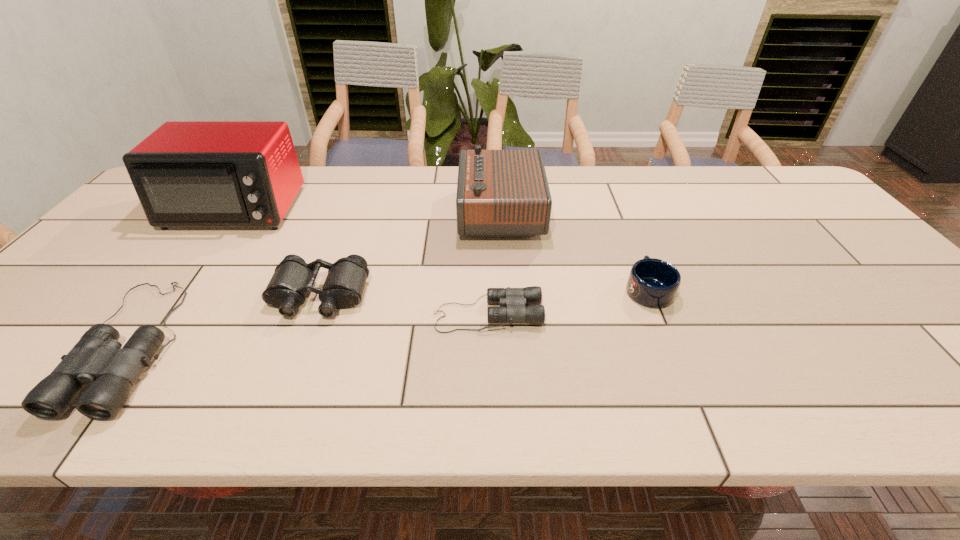
The height and width of the screenshot is (540, 960). In order to click on object that is at the far left corner in this screenshot , I will do `click(186, 173)`.

Image resolution: width=960 pixels, height=540 pixels. What are the coordinates of `vacant space at the far edge of the desktop` in the screenshot? It's located at (694, 171).

Locate an element on the screen. The height and width of the screenshot is (540, 960). free space at the near edge of the desktop is located at coordinates (156, 360).

Identify the location of free spot at the left edge of the desktop. Image resolution: width=960 pixels, height=540 pixels. (134, 212).

Find the location of a particular element. The width and height of the screenshot is (960, 540). vacant space at the right edge of the desktop is located at coordinates (874, 268).

This screenshot has height=540, width=960. I want to click on free region at the near left corner of the desktop, so click(x=27, y=347).

In the image, there is a desktop. At what (x,y) coordinates should I click in order to perform the action: click on vacant space at the far right corner. Please return your answer as a coordinate pair (x, y). Looking at the image, I should click on (776, 175).

Where is `vacant area at the near right corner`? The image size is (960, 540). vacant area at the near right corner is located at coordinates (899, 347).

Locate an element on the screen. vacant space in between the leftmost binoculars and the toaster oven is located at coordinates (183, 277).

Locate an element on the screen. free space between the rightmost binoculars and the rightmost object is located at coordinates (568, 302).